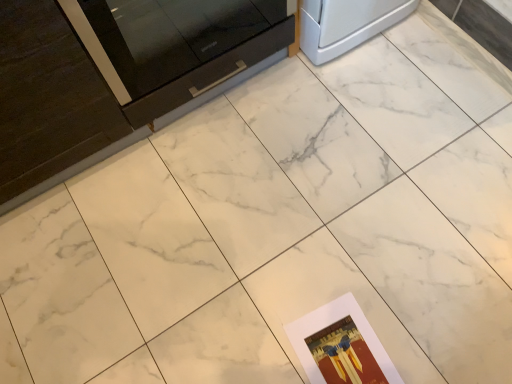
Question: Should I look upward or downward to see glossy black drawer at upper left?

Choices:
 (A) up
 (B) down

Answer: (A)

Question: Is glossy black drawer at upper left bigger than matte paper postcard at lower right?

Choices:
 (A) no
 (B) yes

Answer: (B)

Question: Is glossy black drawer at upper left surrounding matte paper postcard at lower right?

Choices:
 (A) no
 (B) yes

Answer: (A)

Question: From a real-world perspective, does glossy black drawer at upper left sit lower than matte paper postcard at lower right?

Choices:
 (A) yes
 (B) no

Answer: (B)

Question: Is the depth of glossy black drawer at upper left less than that of matte paper postcard at lower right?

Choices:
 (A) yes
 (B) no

Answer: (A)

Question: Can you confirm if glossy black drawer at upper left is wider than matte paper postcard at lower right?

Choices:
 (A) yes
 (B) no

Answer: (B)

Question: From the image's perspective, is glossy black drawer at upper left below matte paper postcard at lower right?

Choices:
 (A) yes
 (B) no

Answer: (B)

Question: From the image's perspective, would you say matte paper postcard at lower right is shown under glossy black drawer at upper left?

Choices:
 (A) yes
 (B) no

Answer: (A)

Question: From the image's perspective, would you say matte paper postcard at lower right is positioned over glossy black drawer at upper left?

Choices:
 (A) no
 (B) yes

Answer: (A)

Question: Could you tell me if matte paper postcard at lower right is turned towards glossy black drawer at upper left?

Choices:
 (A) no
 (B) yes

Answer: (A)

Question: Considering the relative sizes of matte paper postcard at lower right and glossy black drawer at upper left in the image provided, is matte paper postcard at lower right taller than glossy black drawer at upper left?

Choices:
 (A) yes
 (B) no

Answer: (B)

Question: Can we say matte paper postcard at lower right lies outside glossy black drawer at upper left?

Choices:
 (A) no
 (B) yes

Answer: (B)

Question: Does matte paper postcard at lower right lie behind glossy black drawer at upper left?

Choices:
 (A) yes
 (B) no

Answer: (A)

Question: Is matte paper postcard at lower right wider or thinner than glossy black drawer at upper left?

Choices:
 (A) thin
 (B) wide

Answer: (B)